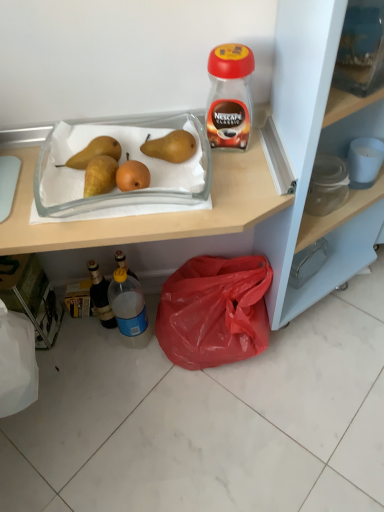
Question: From a real-world perspective, is translucent plastic bottle at lower left, acting as the first bottle starting from the left, positioned above or below brown matte pear at upper center, marked as the first pear in a right-to-left arrangement?

Choices:
 (A) below
 (B) above

Answer: (A)

Question: Considering the positions of point click(x=94, y=306) and point click(x=172, y=134), is point click(x=94, y=306) closer or farther from the camera than point click(x=172, y=134)?

Choices:
 (A) closer
 (B) farther

Answer: (B)

Question: Which of these objects is positioned farthest from the translucent plastic bottle at lower left, which ranks as the second bottle in left-to-right order?

Choices:
 (A) translucent plastic bottle at lower left, acting as the first bottle starting from the left
 (B) transparent glass jar at upper right
 (C) red plastic bag at lower right
 (D) yellow matte pear at upper left, the 2th pear from the right
 (E) clear glass tray at center

Answer: (B)

Question: Which object is the closest to the yellow matte pear at upper left, the 2th pear from the right?

Choices:
 (A) brown matte pear at upper center, positioned as the 2th pear in left-to-right order
 (B) transparent glass jar at upper right
 (C) clear glass tray at center
 (D) red plastic bag at lower right
 (E) matte plastic bag at lower center

Answer: (C)